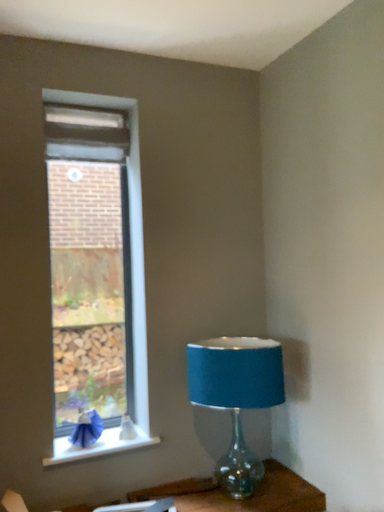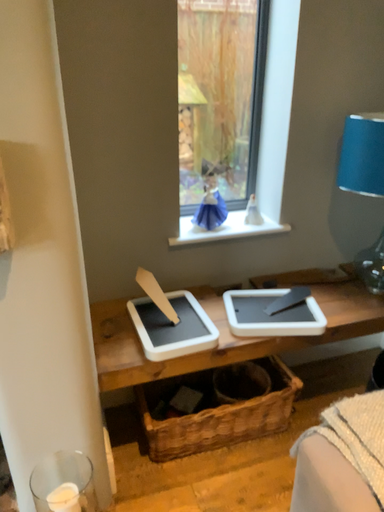
Question: How did the camera likely rotate when shooting the video?

Choices:
 (A) rotated downward
 (B) rotated upward

Answer: (A)